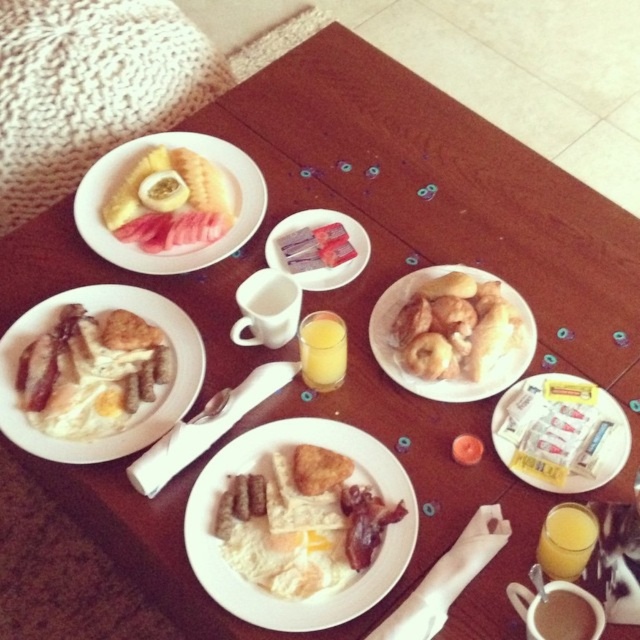
Question: Does matte white plate with breakfast items at center have a lesser width compared to golden fried eggs at center?

Choices:
 (A) yes
 (B) no

Answer: (B)

Question: From the image, what is the correct spatial relationship of matte white plate with breakfast items at center in relation to translucent plastic packets at center?

Choices:
 (A) right
 (B) left

Answer: (B)

Question: Considering the relative positions of golden brown doughnuts at center and brown matte coffee cup at lower right in the image provided, where is golden brown doughnuts at center located with respect to brown matte coffee cup at lower right?

Choices:
 (A) above
 (B) below

Answer: (A)

Question: Considering the real-world distances, which object is farthest from the translucent glass cup of orange juice at bottom right?

Choices:
 (A) translucent plastic packets at center
 (B) yellow matte passion fruit at upper left

Answer: (B)

Question: Which of the following is the farthest from the observer?

Choices:
 (A) brown matte coffee cup at lower right
 (B) matte plastic plate at center
 (C) translucent glass cup of orange juice at center

Answer: (B)

Question: Which of the following is the farthest from the observer?

Choices:
 (A) translucent plastic packets at center
 (B) white paper plate at center
 (C) matte plastic plate at center

Answer: (A)